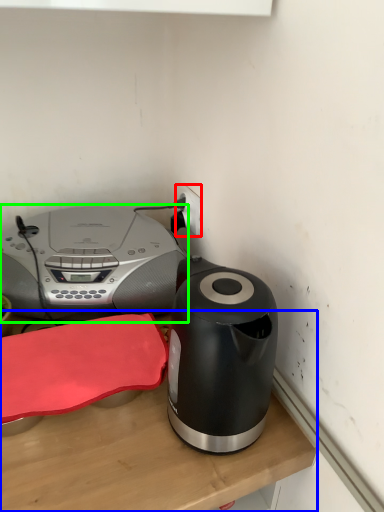
Question: Estimate the real-world distances between objects in this image. Which object is farther from electric outlet (highlighted by a red box), table (highlighted by a blue box) or home appliance (highlighted by a green box)?

Choices:
 (A) table
 (B) home appliance

Answer: (A)